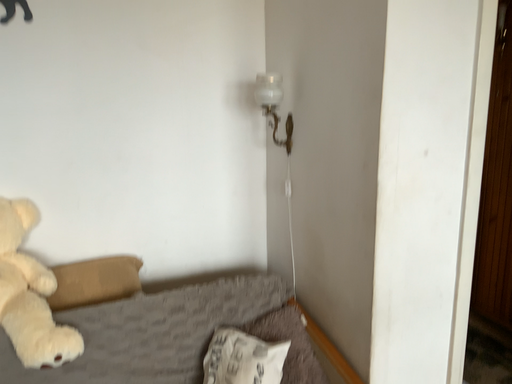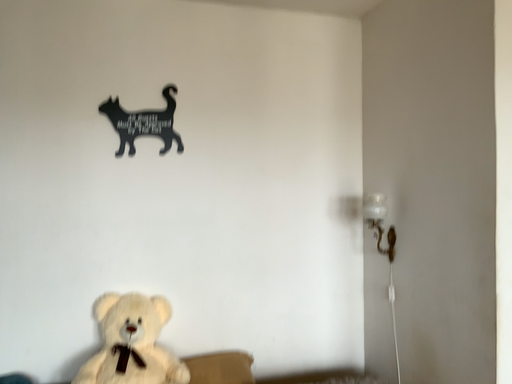
Question: How did the camera likely rotate when shooting the video?

Choices:
 (A) rotated upward
 (B) rotated downward

Answer: (A)